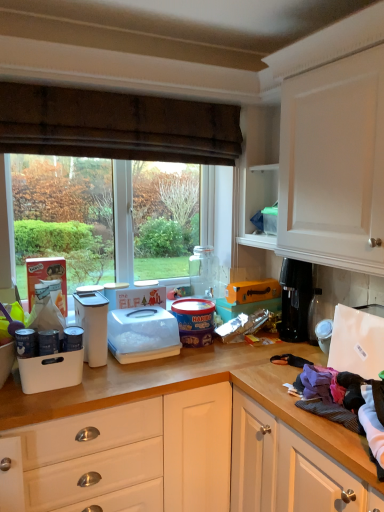
Question: Is orange cardboard box at center, positioned as the first box in top-to-bottom order, outside of metallic silver canister at left, the 1th appliance in the left-to-right sequence?

Choices:
 (A) no
 (B) yes

Answer: (B)

Question: Is orange cardboard box at center, which is the 2th box in bottom-to-top order, aimed at metallic silver canister at left, which ranks as the seventh appliance in right-to-left order?

Choices:
 (A) no
 (B) yes

Answer: (A)

Question: From a real-world perspective, is orange cardboard box at center, which is the 2th box in bottom-to-top order, positioned over metallic silver canister at left, which ranks as the seventh appliance in right-to-left order, based on gravity?

Choices:
 (A) no
 (B) yes

Answer: (B)

Question: Are orange cardboard box at center, which is the 2th box in bottom-to-top order, and metallic silver canister at left, the 1th appliance in the left-to-right sequence, making contact?

Choices:
 (A) no
 (B) yes

Answer: (A)

Question: Would you say orange cardboard box at center, positioned as the first box in top-to-bottom order, is a long distance from metallic silver canister at left, which ranks as the seventh appliance in right-to-left order?

Choices:
 (A) yes
 (B) no

Answer: (A)

Question: Is metallic silver canister at left, the 1th appliance in the left-to-right sequence, inside orange cardboard box at center, positioned as the first box in top-to-bottom order?

Choices:
 (A) yes
 (B) no

Answer: (B)

Question: From the image's perspective, does metallic silver canister at left, which ranks as the seventh appliance in right-to-left order, appear higher than black plastic coffee maker at right, the second appliance in the right-to-left sequence?

Choices:
 (A) yes
 (B) no

Answer: (B)

Question: From the image's perspective, is metallic silver canister at left, the 1th appliance in the left-to-right sequence, under black plastic coffee maker at right, the second appliance in the right-to-left sequence?

Choices:
 (A) yes
 (B) no

Answer: (A)

Question: Considering the relative positions of metallic silver canister at left, which ranks as the seventh appliance in right-to-left order, and black plastic coffee maker at right, the second appliance in the right-to-left sequence, in the image provided, is metallic silver canister at left, which ranks as the seventh appliance in right-to-left order, to the right of black plastic coffee maker at right, the second appliance in the right-to-left sequence, from the viewer's perspective?

Choices:
 (A) yes
 (B) no

Answer: (B)

Question: Does metallic silver canister at left, the 1th appliance in the left-to-right sequence, have a smaller size compared to black plastic coffee maker at right, the second appliance in the right-to-left sequence?

Choices:
 (A) no
 (B) yes

Answer: (B)

Question: Is metallic silver canister at left, the 1th appliance in the left-to-right sequence, with black plastic coffee maker at right, arranged as the 6th appliance when viewed from the left?

Choices:
 (A) yes
 (B) no

Answer: (B)

Question: Can you confirm if metallic silver canister at left, the 1th appliance in the left-to-right sequence, is thinner than black plastic coffee maker at right, the second appliance in the right-to-left sequence?

Choices:
 (A) no
 (B) yes

Answer: (B)

Question: Considering the relative sizes of orange cardboard box at center, which is the 2th box in bottom-to-top order, and brown textured curtain at upper center in the image provided, is orange cardboard box at center, which is the 2th box in bottom-to-top order, smaller than brown textured curtain at upper center?

Choices:
 (A) no
 (B) yes

Answer: (B)